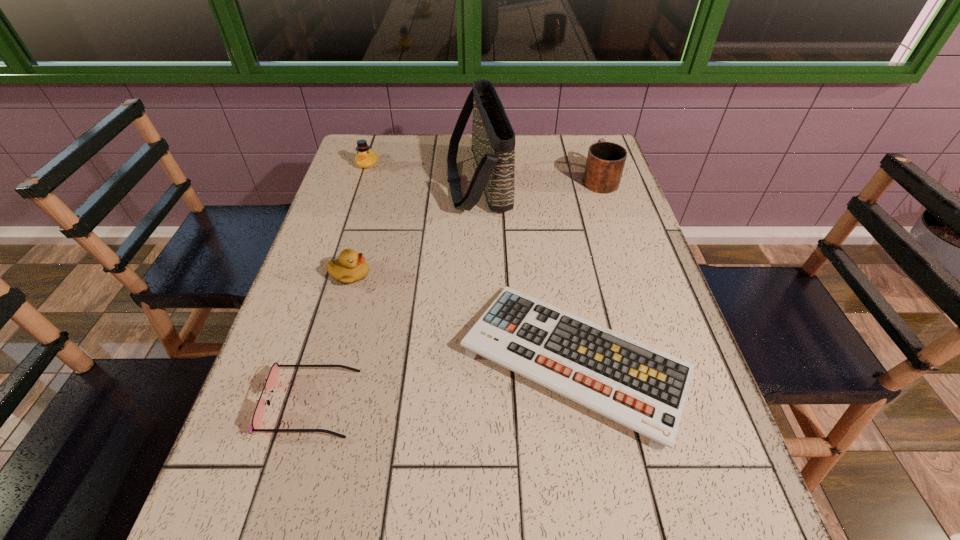
Locate an element on the screen. The height and width of the screenshot is (540, 960). vacant space positioned 0.280m on the bridge of the second shortest object is located at coordinates (501, 403).

The width and height of the screenshot is (960, 540). I want to click on blank space located on the back of the computer keyboard, so click(x=560, y=272).

You are a GUI agent. You are given a task and a screenshot of the screen. Output one action in this format:
    pyautogui.click(x=<x>, y=<y>)
    Task: Click on the handbag present at the far edge
    The width and height of the screenshot is (960, 540).
    Given the screenshot: What is the action you would take?
    pyautogui.click(x=493, y=139)

What are the coordinates of `mug present at the far edge` in the screenshot? It's located at (605, 162).

Find the location of `duck located at the far edge`. duck located at the far edge is located at coordinates (366, 157).

Find the location of a particular element. duck present at the left edge is located at coordinates (366, 157).

Where is `duckling present at the left edge`? duckling present at the left edge is located at coordinates (351, 267).

In order to click on sunglasses situated at the left edge in this screenshot , I will do `click(272, 378)`.

Locate an element on the screen. mug present at the right edge is located at coordinates (605, 162).

What are the coordinates of `computer keyboard situated at the right edge` in the screenshot? It's located at (643, 388).